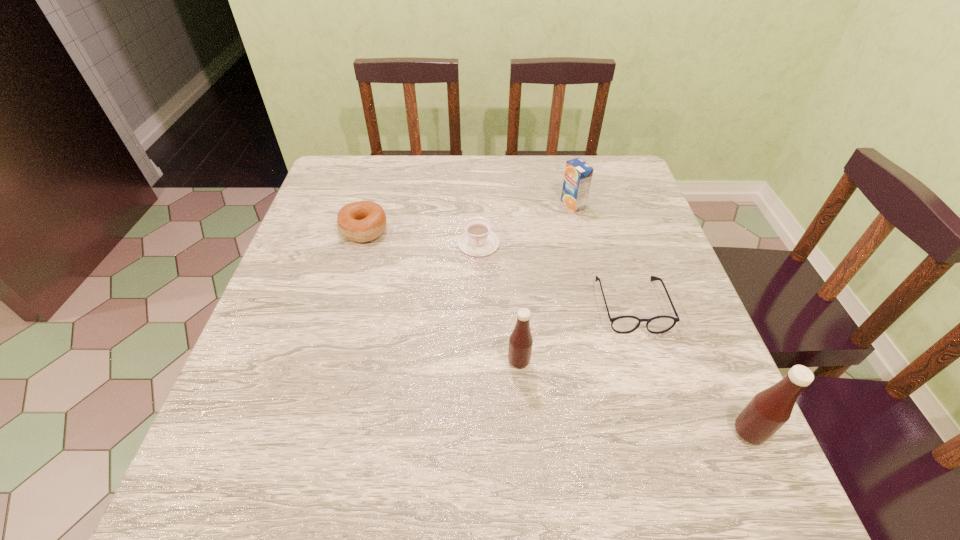
Locate an element on the screen. unoccupied area between the leftmost object and the left Tabasco sauce is located at coordinates (442, 296).

In order to click on vacant region between the teacup and the third nearest object in this screenshot , I will do `click(555, 274)`.

You are a GUI agent. You are given a task and a screenshot of the screen. Output one action in this format:
    pyautogui.click(x=<x>, y=<y>)
    Task: Click on the vacant area that lies between the teacup and the farthest object
    
    Given the screenshot: What is the action you would take?
    pyautogui.click(x=526, y=224)

What are the coordinates of `vacant space that's between the farther Tabasco sauce and the bagel` in the screenshot? It's located at 442,296.

The width and height of the screenshot is (960, 540). Identify the location of free point between the fifth shortest object and the orange_juice. (546, 283).

Image resolution: width=960 pixels, height=540 pixels. What are the coordinates of `object that is the fourth closest to the fifth object from right to left` in the screenshot? It's located at (520, 342).

Select which object appears as the fourth closest to the third tallest object. Please provide its 2D coordinates. Your answer should be formatted as a tuple, i.e. [(x, y)], where the tuple contains the x and y coordinates of a point satisfying the conditions above.

[(520, 342)]

The width and height of the screenshot is (960, 540). I want to click on free location that satisfies the following two spatial constraints: 1. on the handle side of the fifth object from right to left; 2. on the right side of the tallest object, so 478,432.